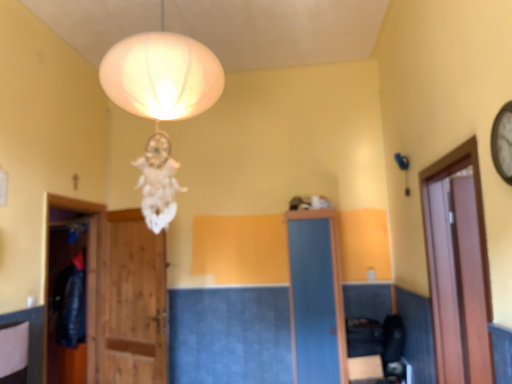
What do you see at coordinates (458, 266) in the screenshot? The width and height of the screenshot is (512, 384). I see `brown wooden door at right` at bounding box center [458, 266].

Find the location of a particular element. The image size is (512, 384). brown wooden door at right is located at coordinates (458, 266).

Describe the element at coordinates (132, 301) in the screenshot. I see `wooden door at center` at that location.

I want to click on wooden door at center, so click(x=132, y=301).

The image size is (512, 384). In order to click on brown wooden door at right in this screenshot , I will do `click(458, 266)`.

Is brown wooden door at right to the left of wooden door at center from the viewer's perspective?

No, brown wooden door at right is not to the left of wooden door at center.

In the image, is brown wooden door at right positioned in front of or behind wooden door at center?

Clearly, brown wooden door at right is in front of wooden door at center.

Which is nearer, (465,169) or (139,286)?

The point (465,169) is closer to the camera.

Based on the photo, from the image's perspective, which object appears higher, brown wooden door at right or wooden door at center?

brown wooden door at right is shown above in the image.

From a real-world perspective, is brown wooden door at right positioned over wooden door at center based on gravity?

Yes, from a real-world perspective, brown wooden door at right is above wooden door at center.

Looking at their sizes, would you say brown wooden door at right is wider or thinner than wooden door at center?

brown wooden door at right is wider than wooden door at center.

Consider the image. Which of these two, brown wooden door at right or wooden door at center, stands taller?

Standing taller between the two is wooden door at center.

Based on the photo, can you confirm if brown wooden door at right is smaller than wooden door at center?

No, brown wooden door at right is not smaller than wooden door at center.

Is brown wooden door at right completely or partially outside of wooden door at center?

That's correct, brown wooden door at right is outside of wooden door at center.

Is brown wooden door at right far away from wooden door at center?

brown wooden door at right is far away from wooden door at center.

Is brown wooden door at right aimed at wooden door at center?

Yes.

What's the angular difference between brown wooden door at right and wooden door at center's facing directions?

The angle between the facing direction of brown wooden door at right and the facing direction of wooden door at center is 62.1 degrees.

Identify the location of glass door on the right of wooden door at center. [458, 266].

In the scene shown: Between wooden door at center and brown wooden door at right, which one appears on the right side from the viewer's perspective?

From the viewer's perspective, brown wooden door at right appears more on the right side.

Considering the positions of objects wooden door at center and brown wooden door at right in the image provided, who is behind, wooden door at center or brown wooden door at right?

wooden door at center is behind.

Which point is more forward, (x=129, y=301) or (x=425, y=201)?

Positioned in front is point (x=425, y=201).

From the image's perspective, is wooden door at center located beneath brown wooden door at right?

Correct, wooden door at center appears lower than brown wooden door at right in the image.

From a real-world perspective, does wooden door at center stand above brown wooden door at right?

No, from a real-world perspective, wooden door at center is not on top of brown wooden door at right.

Based on the photo, is wooden door at center wider than brown wooden door at right?

No, wooden door at center is not wider than brown wooden door at right.

From their relative heights in the image, would you say wooden door at center is taller or shorter than brown wooden door at right?

Clearly, wooden door at center is taller compared to brown wooden door at right.

Which of these two, wooden door at center or brown wooden door at right, is smaller?

wooden door at center.

Would you say wooden door at center is inside or outside brown wooden door at right?

wooden door at center cannot be found inside brown wooden door at right.

Is wooden door at center far away from brown wooden door at right?

Indeed, wooden door at center is not near brown wooden door at right.

Is brown wooden door at right at the back of wooden door at center?

That's not correct — wooden door at center is not looking away from brown wooden door at right.

Image resolution: width=512 pixels, height=384 pixels. In order to click on glass door that appears above the wooden door at center (from the image's perspective) in this screenshot , I will do `click(458, 266)`.

This screenshot has height=384, width=512. Find the location of `glass door on the right of wooden door at center`. glass door on the right of wooden door at center is located at coordinates (458, 266).

At what (x,y) coordinates should I click in order to perform the action: click on door below the brown wooden door at right (from the image's perspective). Please return your answer as a coordinate pair (x, y). Image resolution: width=512 pixels, height=384 pixels. Looking at the image, I should click on (132, 301).